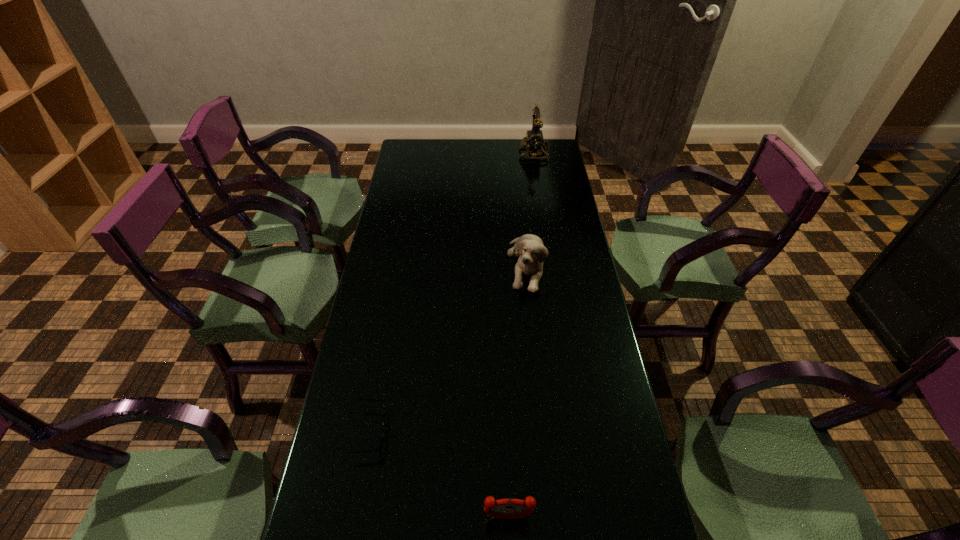
You are a GUI agent. You are given a task and a screenshot of the screen. Output one action in this format:
    pyautogui.click(x=<x>, y=<y>)
    Task: Click on the vacant space at the right edge of the desktop
    The width and height of the screenshot is (960, 540).
    Given the screenshot: What is the action you would take?
    pyautogui.click(x=579, y=451)

At what (x,y) coordinates should I click in order to perform the action: click on free area in between the alarm clock and the third nearest object. Please return your answer as a coordinate pair (x, y). This screenshot has height=540, width=960. Looking at the image, I should click on (517, 391).

Identify the location of vacant point located between the telephone and the spectacles. The height and width of the screenshot is (540, 960). (453, 292).

Where is `vacant area between the third farthest object and the third nearest object`? vacant area between the third farthest object and the third nearest object is located at coordinates (449, 348).

Find the location of a particular element. free space between the farthest object and the second shortest object is located at coordinates (521, 335).

You are a GUI agent. You are given a task and a screenshot of the screen. Output one action in this format:
    pyautogui.click(x=<x>, y=<y>)
    Task: Click on the vacant space in between the leftmost object and the alarm clock
    The height and width of the screenshot is (540, 960).
    Given the screenshot: What is the action you would take?
    pyautogui.click(x=440, y=475)

You are a GUI agent. You are given a task and a screenshot of the screen. Output one action in this format:
    pyautogui.click(x=<x>, y=<y>)
    Task: Click on the empty space between the second tallest object and the alarm clock
    The image size is (960, 540).
    Given the screenshot: What is the action you would take?
    pyautogui.click(x=517, y=391)

Identify the location of blank region between the third farthest object and the alarm clock. (440, 475).

In order to click on free space between the second tallest object and the leftmost object in this screenshot , I will do `click(449, 348)`.

The height and width of the screenshot is (540, 960). Find the location of `free space between the telephone and the third farthest object`. free space between the telephone and the third farthest object is located at coordinates (453, 292).